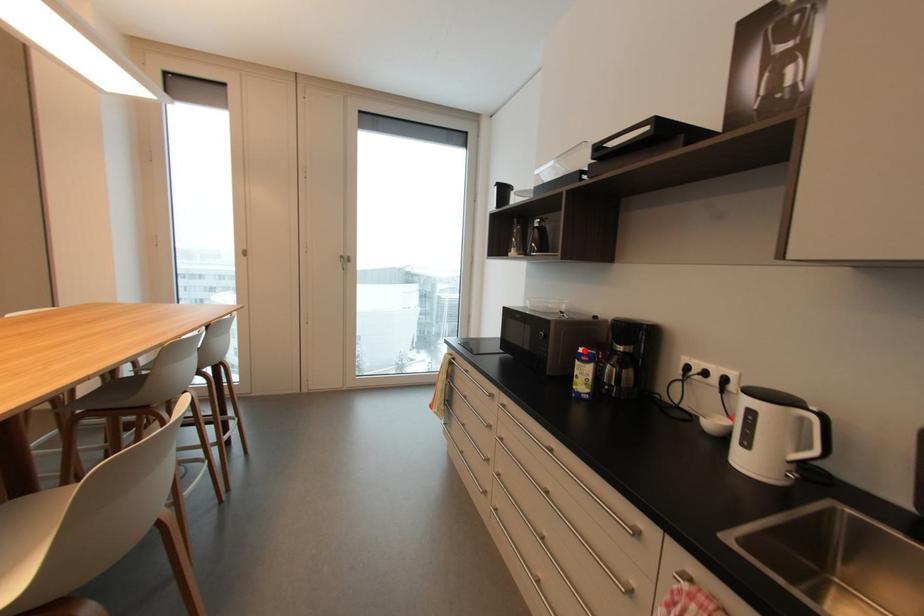
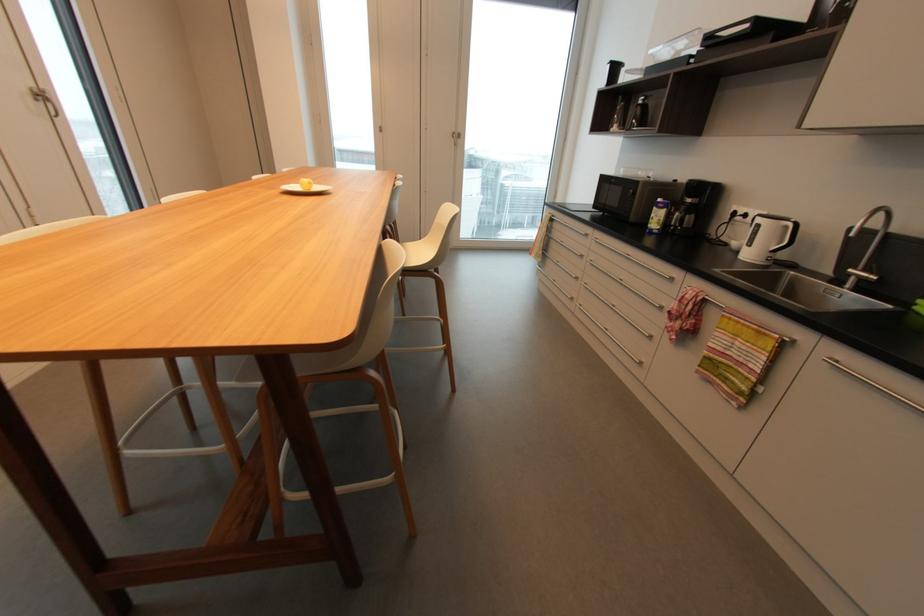
Question: A red point is marked in image1. In image2, is the corresponding 3D point closer to the camera or farther? Reply with the corresponding letter.

Choices:
 (A) The corresponding 3D point is closer.
 (B) The corresponding 3D point is farther.

Answer: (A)